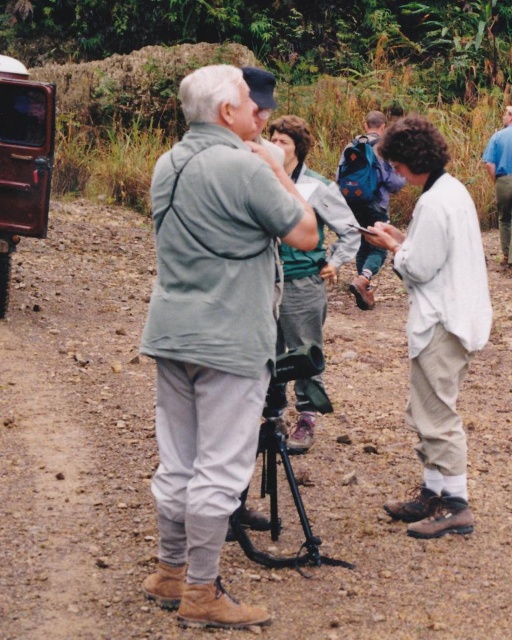
Question: Is brown dirt track at center to the left of gray fabric jacket at center from the viewer's perspective?

Choices:
 (A) yes
 (B) no

Answer: (B)

Question: Among these points, which one is farthest from the camera?

Choices:
 (A) (165, 429)
 (B) (279, 116)

Answer: (B)

Question: Does black matte tripod at center appear under white cotton shirt at right?

Choices:
 (A) no
 (B) yes

Answer: (B)

Question: Which object is farther from the camera taking this photo?

Choices:
 (A) white cotton shirt at right
 (B) white cotton shirt at center

Answer: (A)

Question: Is brown dirt track at center further to the viewer compared to black matte tripod at center?

Choices:
 (A) yes
 (B) no

Answer: (B)

Question: Estimate the real-world distances between objects in this image. Which object is farther from the black matte tripod at center?

Choices:
 (A) gray fabric jacket at center
 (B) matte gray jacket at center
 (C) white cotton shirt at right

Answer: (C)